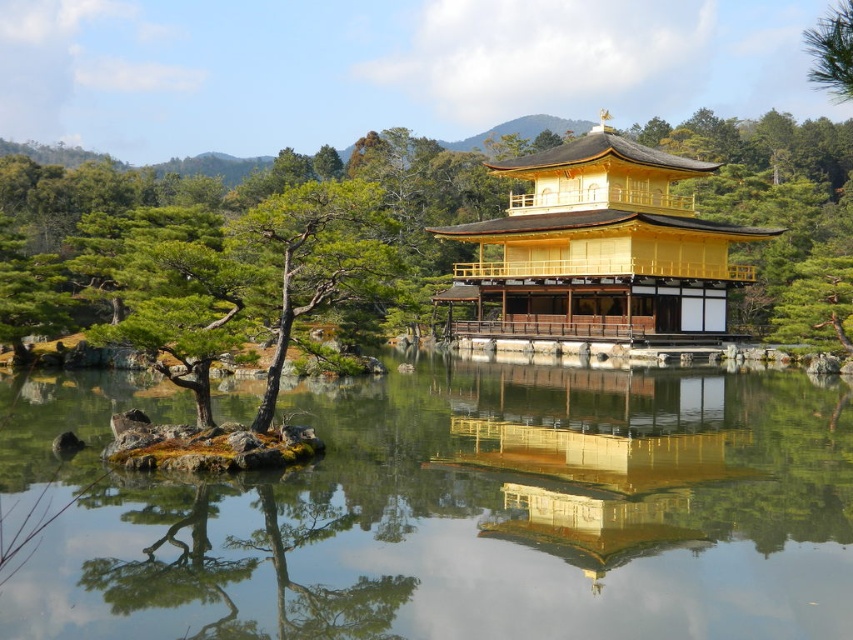
Question: Can you confirm if gold reflective surface at center is positioned to the right of smooth brown bark tree at center?

Choices:
 (A) yes
 (B) no

Answer: (A)

Question: Which of the following is the closest to the observer?

Choices:
 (A) coord(834,61)
 (B) coord(57,600)
 (C) coord(543,461)
 (D) coord(666,310)

Answer: (B)

Question: Which of the following is the closest to the observer?

Choices:
 (A) gold reflective surface at center
 (B) golden polished wood palace at center
 (C) smooth brown bark tree at center

Answer: (A)

Question: Is smooth brown bark tree at center closer to the viewer compared to green textured pine tree at upper right?

Choices:
 (A) no
 (B) yes

Answer: (A)

Question: Can you confirm if transparent water at center is positioned to the left of smooth brown bark tree at center?

Choices:
 (A) yes
 (B) no

Answer: (B)

Question: Among these objects, which one is nearest to the camera?

Choices:
 (A) transparent water at center
 (B) gold reflective surface at center
 (C) green textured pine tree at upper right
 (D) smooth brown bark tree at center

Answer: (A)